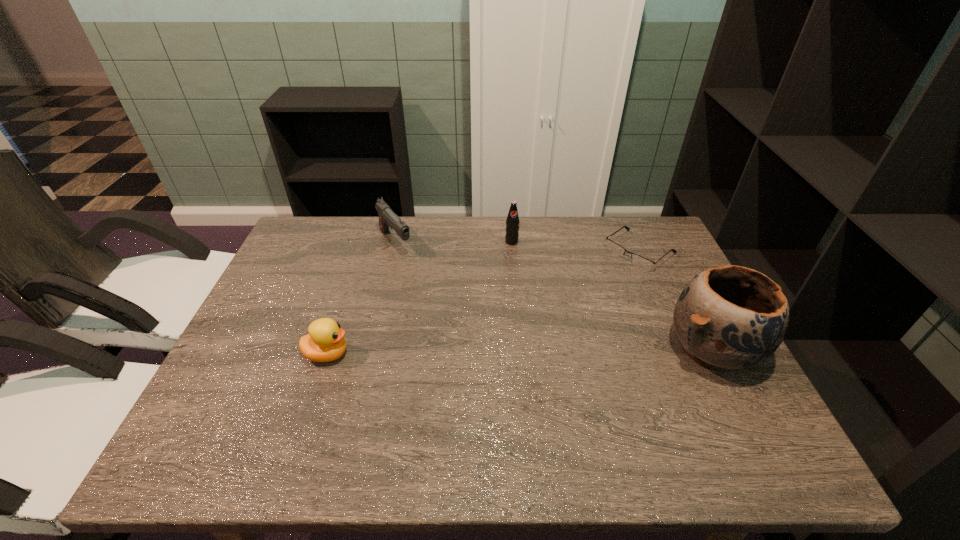
At what (x,y) coordinates should I click in order to perform the action: click on the second shortest object. Please return your answer as a coordinate pair (x, y). Looking at the image, I should click on (325, 342).

This screenshot has height=540, width=960. What are the coordinates of `pottery` in the screenshot? It's located at (728, 317).

You are a GUI agent. You are given a task and a screenshot of the screen. Output one action in this format:
    pyautogui.click(x=<x>, y=<y>)
    Task: Click on the gun
    
    Given the screenshot: What is the action you would take?
    pyautogui.click(x=387, y=218)

In order to click on spectacles in this screenshot , I will do `click(639, 261)`.

Find the location of `the third object from left to right`. the third object from left to right is located at coordinates (512, 222).

You are a GUI agent. You are given a task and a screenshot of the screen. Output one action in this format:
    pyautogui.click(x=<x>, y=<y>)
    Task: Click on the free space located 0.400m on the face of the duckling
    
    Given the screenshot: What is the action you would take?
    pyautogui.click(x=517, y=354)

Locate an element on the screen. This screenshot has height=540, width=960. free space located on the left of the tallest object is located at coordinates (540, 349).

Locate an element on the screen. free location located 0.130m in the direction the gun is aimed is located at coordinates (424, 281).

Locate an element on the screen. The width and height of the screenshot is (960, 540). free space located in the direction the gun is aimed is located at coordinates (437, 295).

What are the coordinates of `free space located in the direction the gun is aimed` in the screenshot? It's located at (431, 288).